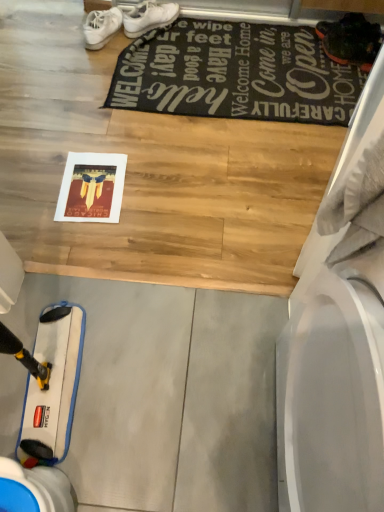
Where is `free space between black fabric mat at upper center and white matte sneakers at upper center`? free space between black fabric mat at upper center and white matte sneakers at upper center is located at coordinates (96, 77).